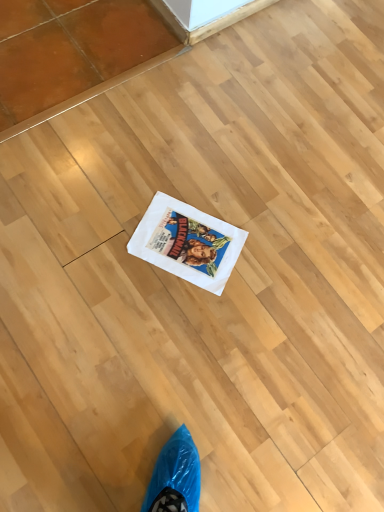
Where is `empty space that is to the right of white paper comic book at center`? This screenshot has height=512, width=384. empty space that is to the right of white paper comic book at center is located at coordinates (274, 267).